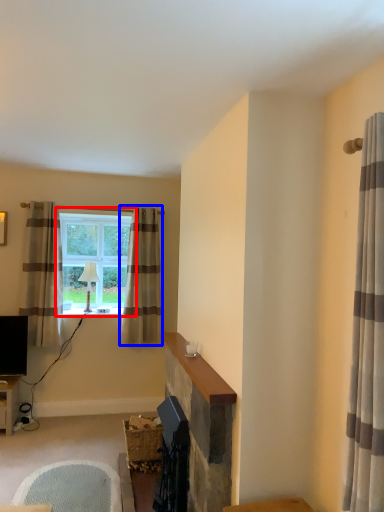
Question: Which object appears closest to the camera in this image, window (highlighted by a red box) or curtain (highlighted by a blue box)?

Choices:
 (A) window
 (B) curtain

Answer: (B)